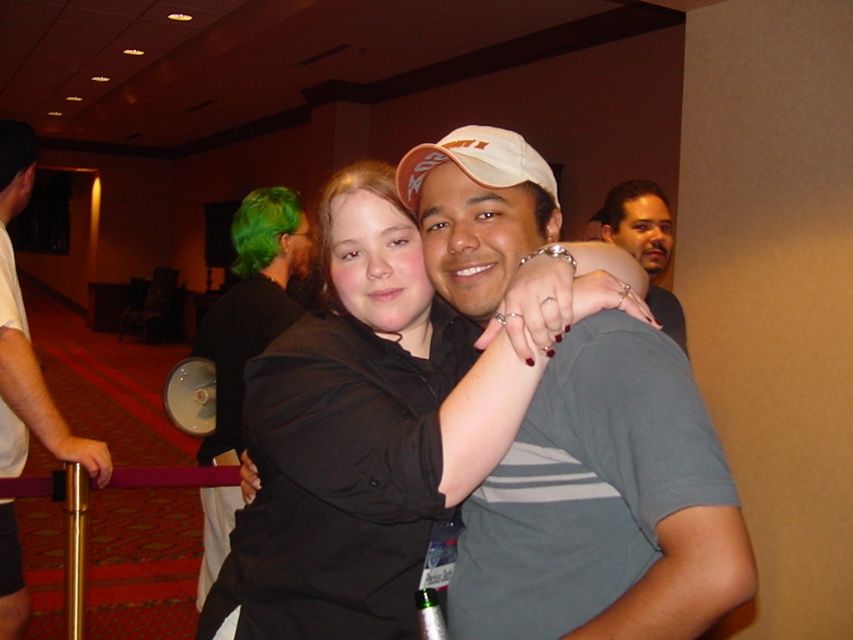
Can you confirm if matte gray t-shirt at center is positioned to the left of black fabric shirt at center?

Incorrect, matte gray t-shirt at center is not on the left side of black fabric shirt at center.

Does matte gray t-shirt at center have a smaller size compared to black fabric shirt at center?

Yes, matte gray t-shirt at center is smaller than black fabric shirt at center.

Does point (544, 515) come behind point (206, 544)?

That is False.

This screenshot has width=853, height=640. What are the coordinates of `matte gray t-shirt at center` in the screenshot? It's located at (605, 502).

What do you see at coordinates (251, 301) in the screenshot? I see `black fabric shirt at center` at bounding box center [251, 301].

Who is more forward, (228,289) or (641,212)?

Positioned in front is point (641,212).

Identify the location of black fabric shirt at center. The height and width of the screenshot is (640, 853). (251, 301).

Between white matte shirt at center and gray cotton shirt at center, which one appears on the right side from the viewer's perspective?

gray cotton shirt at center

Identify the location of white matte shirt at center. (27, 337).